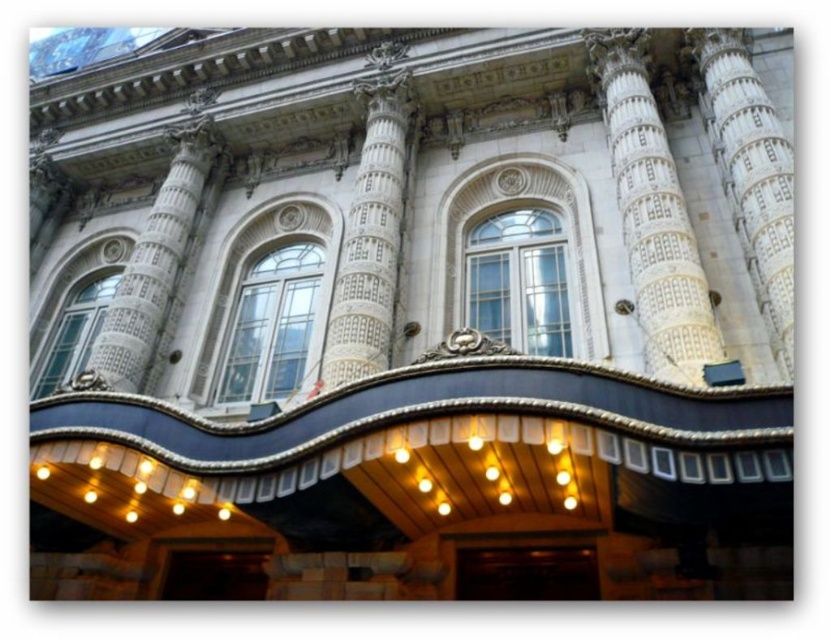
Question: Can you confirm if white stone column at center is wider than white marble column at upper left?

Choices:
 (A) yes
 (B) no

Answer: (B)

Question: Does white stone column at center appear on the left side of white marble column at center?

Choices:
 (A) no
 (B) yes

Answer: (B)

Question: Which point is closer to the camera?

Choices:
 (A) (654, 196)
 (B) (151, 272)

Answer: (A)

Question: Which object is farther from the camera taking this photo?

Choices:
 (A) white textured column at center
 (B) white marble column at upper left

Answer: (A)

Question: Is white stone column at center smaller than white marble column at upper left?

Choices:
 (A) yes
 (B) no

Answer: (A)

Question: Which point appears farthest from the camera in this image?

Choices:
 (A) (637, 35)
 (B) (692, 42)
 (C) (114, 324)
 (D) (327, 381)

Answer: (A)